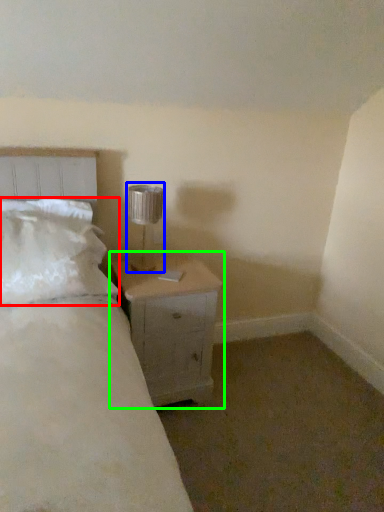
Question: Considering the real-world distances, which object is farthest from pillow (highlighted by a red box)? lamp (highlighted by a blue box) or nightstand (highlighted by a green box)?

Choices:
 (A) lamp
 (B) nightstand

Answer: (A)